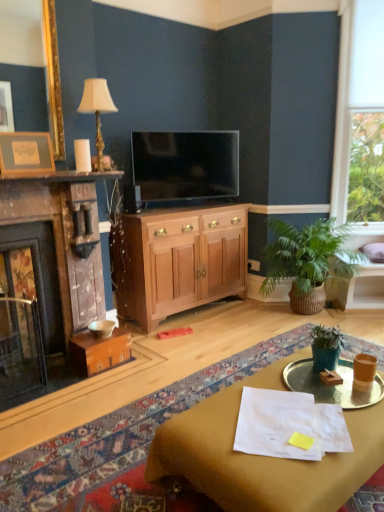
Where is `free location in front of wooden cabinet at center`? free location in front of wooden cabinet at center is located at coordinates (189, 342).